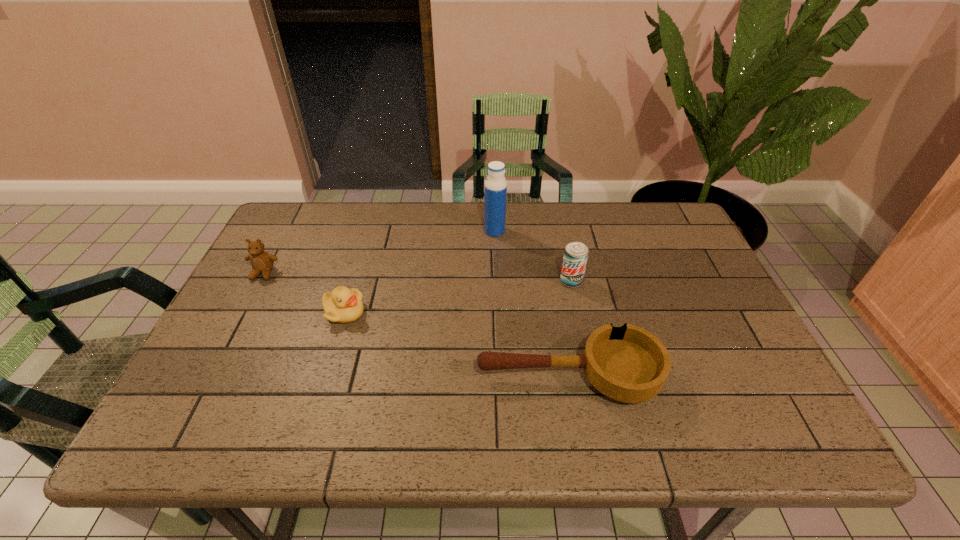
I want to click on free space between the beer can and the second object from left to right, so click(x=458, y=297).

You are a GUI agent. You are given a task and a screenshot of the screen. Output one action in this format:
    pyautogui.click(x=<x>, y=<y>)
    Task: Click on the free area in between the beer can and the nearest object
    This screenshot has width=960, height=540.
    Given the screenshot: What is the action you would take?
    pyautogui.click(x=569, y=329)

Find the location of `blank region between the saucepan and the beer can`. blank region between the saucepan and the beer can is located at coordinates (569, 329).

Find the location of a particular element. This screenshot has width=960, height=540. free area in between the duckling and the water bottle is located at coordinates (420, 272).

Locate which object is the fourth closest to the nearest object. Please provide its 2D coordinates. Your answer should be formatted as a tuple, i.e. [(x, y)], where the tuple contains the x and y coordinates of a point satisfying the conditions above.

[(262, 262)]

You are a GUI agent. You are given a task and a screenshot of the screen. Output one action in this format:
    pyautogui.click(x=<x>, y=<y>)
    Task: Click on the object that can be found as the second closest to the beer can
    This screenshot has height=540, width=960.
    Given the screenshot: What is the action you would take?
    pyautogui.click(x=495, y=185)

Where is `free space that satisfies the following two spatial constraints: 1. with the handle on the side of the nearest object; 2. on the right side of the beer can`? The height and width of the screenshot is (540, 960). free space that satisfies the following two spatial constraints: 1. with the handle on the side of the nearest object; 2. on the right side of the beer can is located at coordinates (552, 281).

At what (x,y) coordinates should I click in order to perform the action: click on vacant point that satisfies the following two spatial constraints: 1. with the handle on the side of the saucepan; 2. on the front-facing side of the teddy bear. Please return your answer as a coordinate pair (x, y). The width and height of the screenshot is (960, 540). Looking at the image, I should click on (550, 273).

What are the coordinates of `free region that satisfies the following two spatial constraints: 1. on the front-facing side of the teddy bear; 2. on the left side of the beer can` in the screenshot? It's located at (259, 281).

Find the location of `vacant space that satisfies the following two spatial constraints: 1. with the handle on the side of the nearest object; 2. on the beak of the second nearest object`. vacant space that satisfies the following two spatial constraints: 1. with the handle on the side of the nearest object; 2. on the beak of the second nearest object is located at coordinates (557, 313).